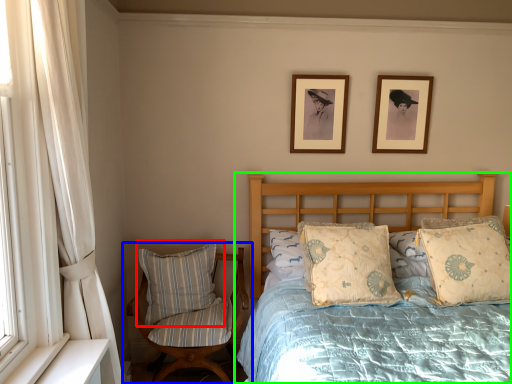
Question: Which object is the farthest from pillow (highlighted by a red box)? Choose among these: chair (highlighted by a blue box) or bed (highlighted by a green box).

Choices:
 (A) chair
 (B) bed

Answer: (B)